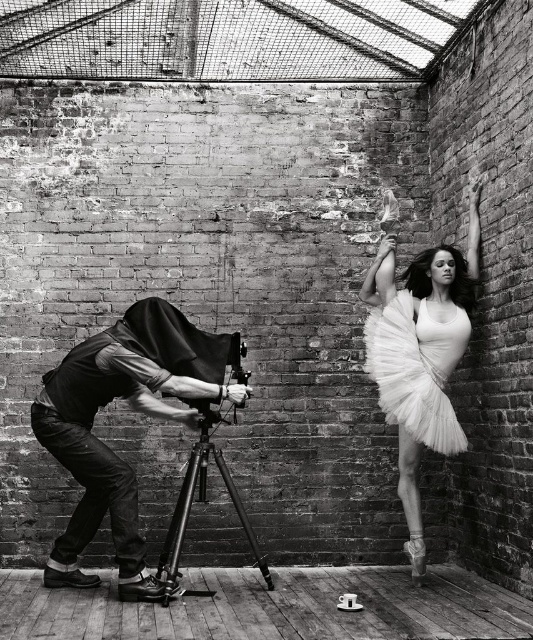
Who is positioned more to the right, denim vest at left or white tulle dress at upper right?

Positioned to the right is white tulle dress at upper right.

This screenshot has width=533, height=640. In order to click on denim vest at left in this screenshot , I will do `click(132, 406)`.

Between white fluffy tutu at upper right and white tulle dress at upper right, which one appears on the right side from the viewer's perspective?

From the viewer's perspective, white tulle dress at upper right appears more on the right side.

Is white fluffy tutu at upper right shorter than white tulle dress at upper right?

Incorrect, white fluffy tutu at upper right's height does not fall short of white tulle dress at upper right's.

You are a GUI agent. You are given a task and a screenshot of the screen. Output one action in this format:
    pyautogui.click(x=<x>, y=<y>)
    Task: Click on the white fluffy tutu at upper right
    
    Given the screenshot: What is the action you would take?
    pyautogui.click(x=421, y=355)

At what (x,y) coordinates should I click in order to perform the action: click on denim vest at left. Please return your answer as a coordinate pair (x, y). Image resolution: width=533 pixels, height=640 pixels. Looking at the image, I should click on (132, 406).

Where is `denim vest at left`? denim vest at left is located at coordinates tap(132, 406).